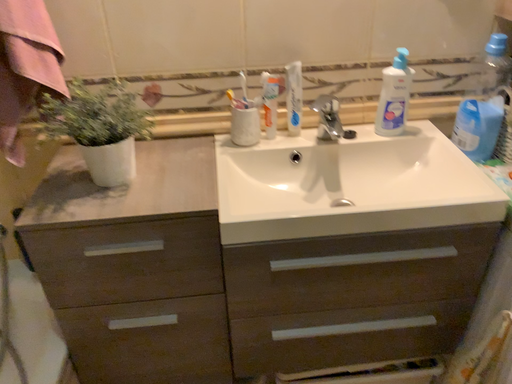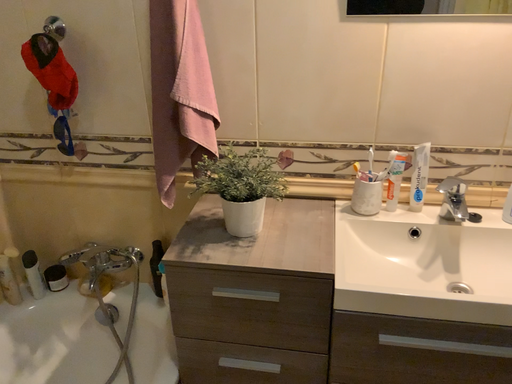
Question: Which way did the camera rotate in the video?

Choices:
 (A) rotated downward
 (B) rotated upward

Answer: (B)